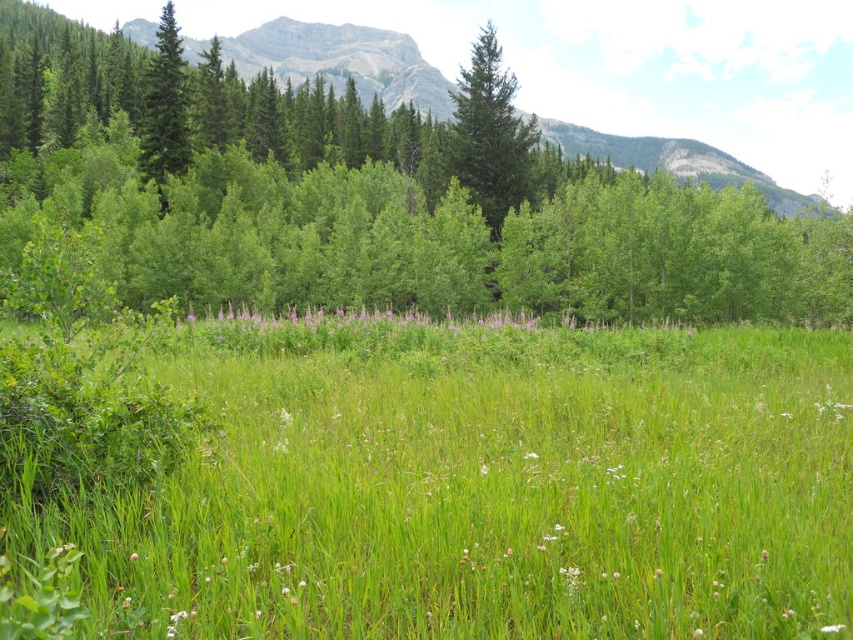
Question: Can you confirm if green grassy pasture at center is bigger than green matte evergreen tree at left?

Choices:
 (A) yes
 (B) no

Answer: (B)

Question: Observing the image, what is the correct spatial positioning of green grassy pasture at center in reference to green matte tree at center?

Choices:
 (A) above
 (B) below

Answer: (B)

Question: Which of the following is the farthest from the observer?

Choices:
 (A) purple soft grass at center
 (B) white fluffy flower at center
 (C) green matte tree at center
 (D) green leafy tree at center

Answer: (C)

Question: Which of the following is the farthest from the observer?

Choices:
 (A) green leafy tree at center
 (B) green grassy pasture at center

Answer: (A)

Question: Which point is closer to the camera?

Choices:
 (A) purple soft grass at center
 (B) white fluffy flower at center
 (C) green matte tree at center
 (D) green matte evergreen tree at left

Answer: (B)

Question: Observing the image, what is the correct spatial positioning of green grassy pasture at center in reference to green leafy tree at center?

Choices:
 (A) left
 (B) right

Answer: (B)